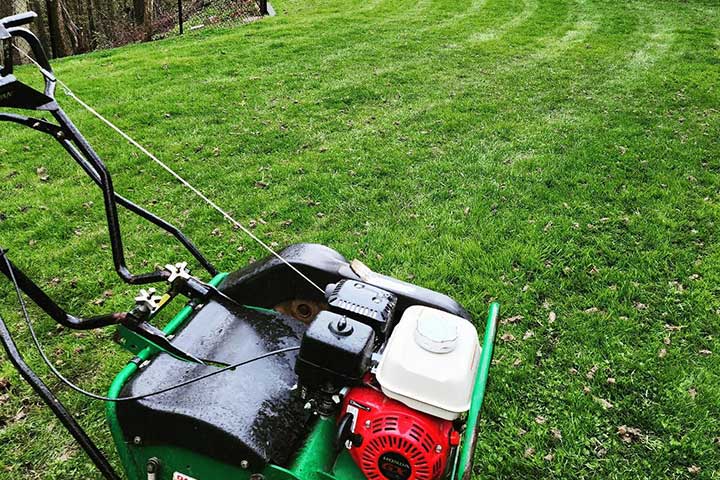
The height and width of the screenshot is (480, 720). What are the coordinates of `black handle` in the screenshot? It's located at (27, 35).